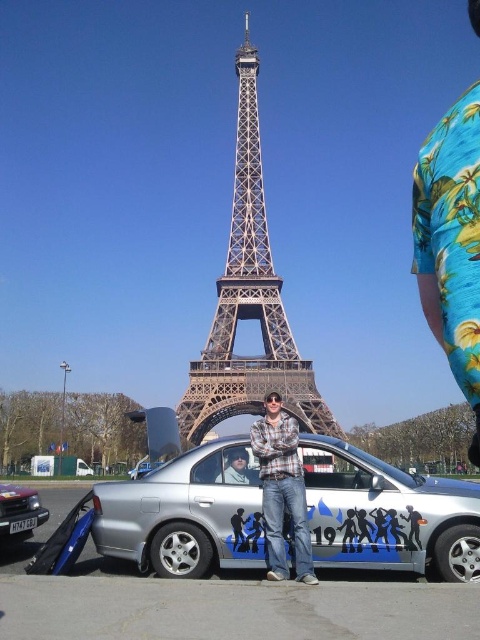
You are a photographer trying to capture a group photo of the plaid shirt at center and the matte black jacket at center. If you want to ensure both subjects are fully visible in the frame, which subject should you position closer to the camera to maintain their proportions?

The plaid shirt at center has a larger width than the matte black jacket at center. To maintain proportions and ensure both are fully visible, position the plaid shirt at center closer to the camera since larger objects need to be nearer to appear appropriately sized relative to smaller ones.

You are standing at the base of the Eiffel Tower and want to take a photo of the point at coordinates point (298, 435). If your camera has a maximum zoom range of 100 meters, will you be able to capture that point clearly?

The distance of point (298, 435) from viewer is 125.49 meters, which exceeds the camera maximum zoom range of 100 meters. Therefore, you cannot capture that point clearly.

You are a photographer trying to capture a wide shot of the Eiffel Tower. You have a camera that can only capture objects up to 2 meters wide. The plaid shirt at center and the silver metallic sedan at center are both in your frame. Which object will definitely fit within your camera frame based on their widths?

The plaid shirt at center has a greater width than the silver metallic sedan at center, so the silver metallic sedan at center will definitely fit within the camera frame since its width is less than 2 meters. The plaid shirt at center might not fit if its width exceeds 2 meters.